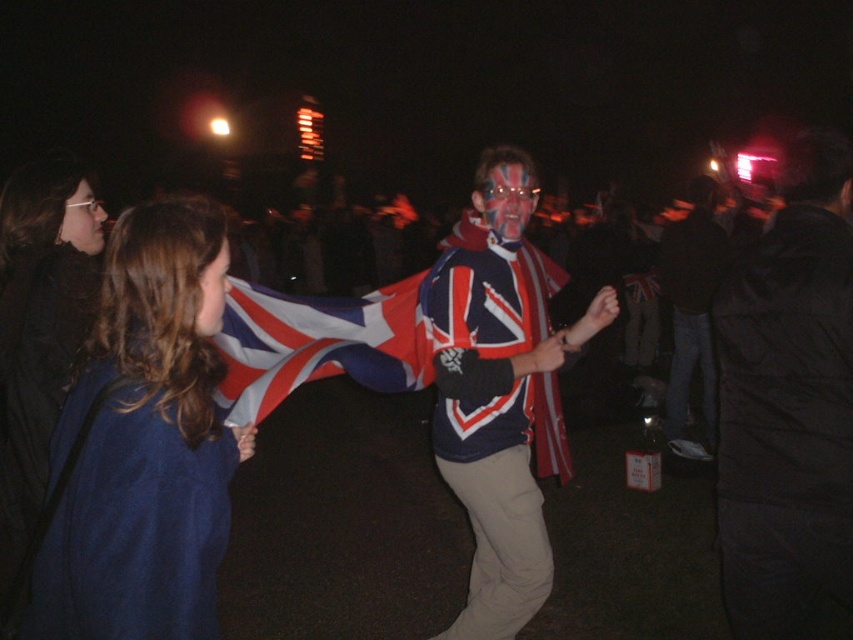
Question: Which point is closer to the camera taking this photo?

Choices:
 (A) (721, 256)
 (B) (596, 300)

Answer: (B)

Question: Does union jack flag at center appear on the left side of matte red flag at center?

Choices:
 (A) no
 (B) yes

Answer: (B)

Question: Which object is closer to the camera taking this photo?

Choices:
 (A) union jack flag at center
 (B) matte black glasses at upper left
 (C) union jack painted face at center
 (D) union jack scarf at center

Answer: (A)

Question: Is union jack scarf at center above union jack flag at center?

Choices:
 (A) no
 (B) yes

Answer: (A)

Question: Does matte black glasses at upper left appear on the right side of matte red flag at center?

Choices:
 (A) yes
 (B) no

Answer: (B)

Question: Which of the following is the farthest from the observer?

Choices:
 (A) (213, 330)
 (B) (822, 312)

Answer: (B)